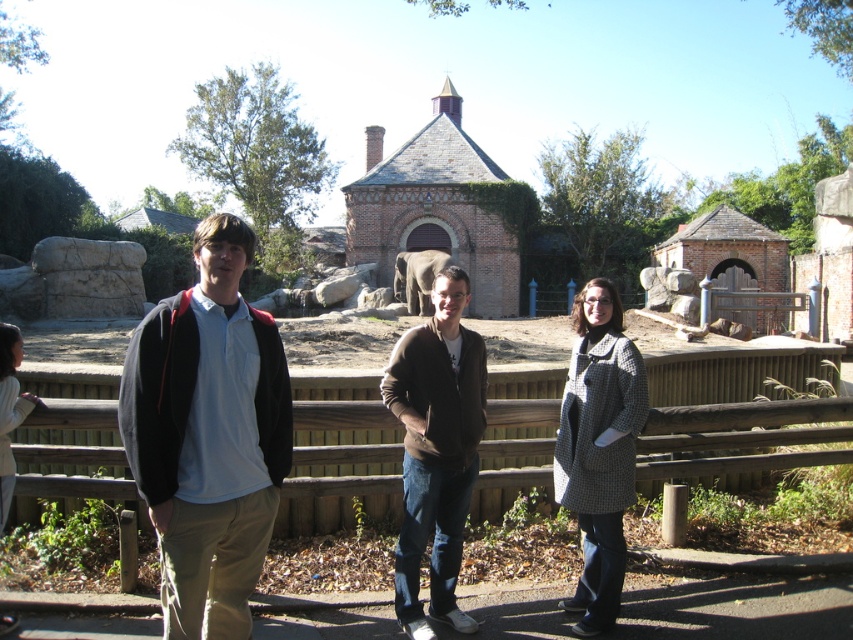
Who is shorter, wooden at center or matte black jacket at center?

wooden at center is shorter.

How distant is wooden at center from matte black jacket at center?

wooden at center and matte black jacket at center are 9.43 feet apart from each other.

Which is behind, point (526, 392) or point (163, 342)?

Positioned behind is point (526, 392).

Identify the location of wooden at center. The width and height of the screenshot is (853, 640). (735, 413).

What do you see at coordinates (436, 449) in the screenshot? I see `brown sweater at center` at bounding box center [436, 449].

Does point (457, 268) lie in front of point (605, 400)?

No.

Does point (436, 600) come closer to viewer compared to point (582, 403)?

Yes, it is in front of point (582, 403).

The height and width of the screenshot is (640, 853). I want to click on brown sweater at center, so click(436, 449).

In the scene shown: Who is shorter, matte black jacket at center or light gray sweater at center?

Standing shorter between the two is light gray sweater at center.

Is matte black jacket at center positioned behind light gray sweater at center?

No, matte black jacket at center is closer to the viewer.

Between point (276, 438) and point (10, 497), which one is positioned in front?

Point (276, 438) is more forward.

The height and width of the screenshot is (640, 853). I want to click on matte black jacket at center, so click(207, 435).